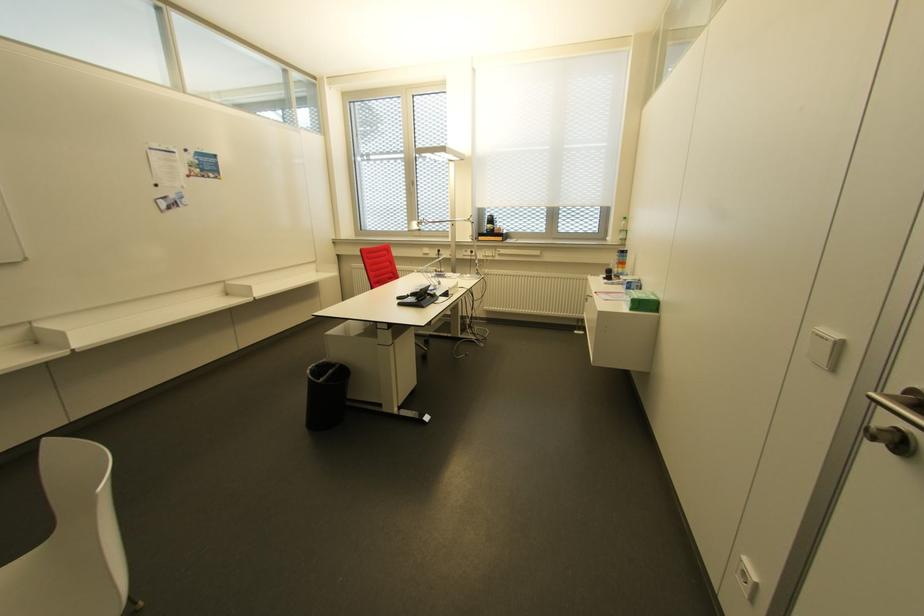
Locate an element on the screen. The height and width of the screenshot is (616, 924). black phone handset is located at coordinates (420, 293).